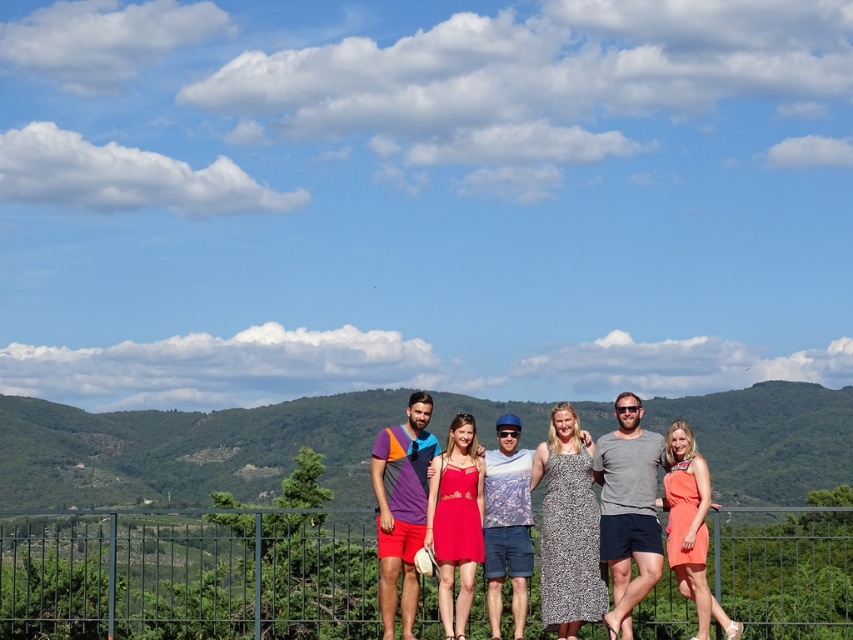
Question: Which is nearer to the green metal fence at lower center?

Choices:
 (A) blue denim shorts at center
 (B) matte red dress at center
 (C) gray cotton t-shirt at center
 (D) orange satin dress at right

Answer: (B)

Question: Estimate the real-world distances between objects in this image. Which object is closer to the green leafy mountain at center?

Choices:
 (A) multicolored jersey at center
 (B) blue denim shorts at center
 (C) matte red dress at center

Answer: (B)

Question: Can you confirm if matte red dress at center is bigger than orange satin dress at right?

Choices:
 (A) no
 (B) yes

Answer: (A)

Question: Considering the relative positions of green leafy mountain at center and matte red dress at center in the image provided, where is green leafy mountain at center located with respect to matte red dress at center?

Choices:
 (A) above
 (B) below

Answer: (B)

Question: Estimate the real-world distances between objects in this image. Which object is closer to the green leafy mountain at center?

Choices:
 (A) blue denim shorts at center
 (B) matte red dress at center

Answer: (A)

Question: Is green leafy mountain at center thinner than orange satin dress at right?

Choices:
 (A) yes
 (B) no

Answer: (B)